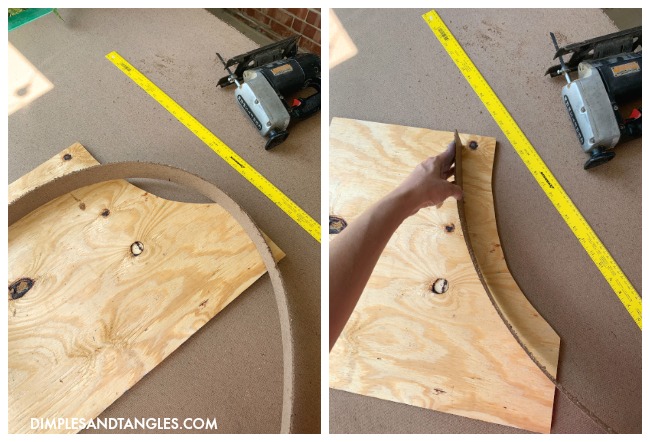
I want to click on light, so (21, 69), (341, 51).